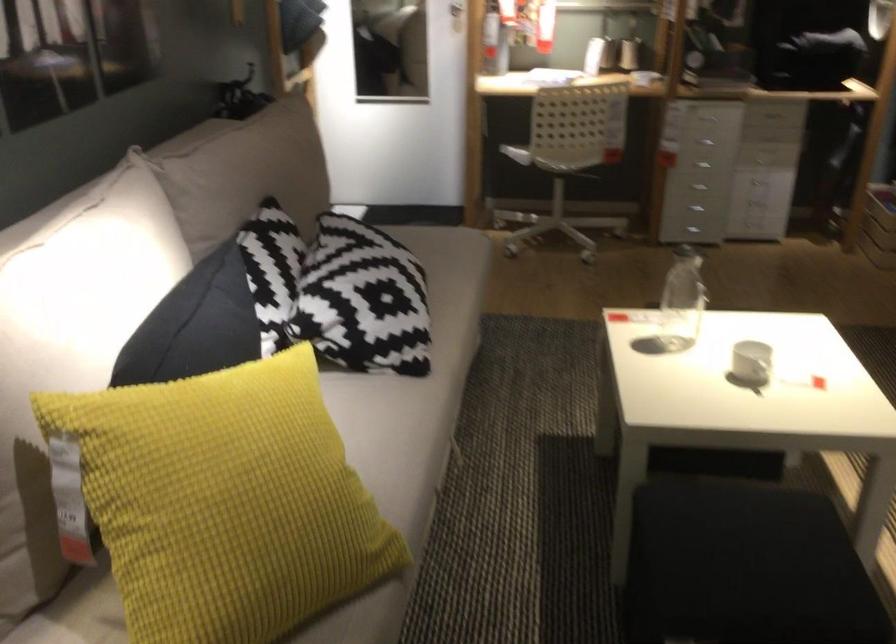
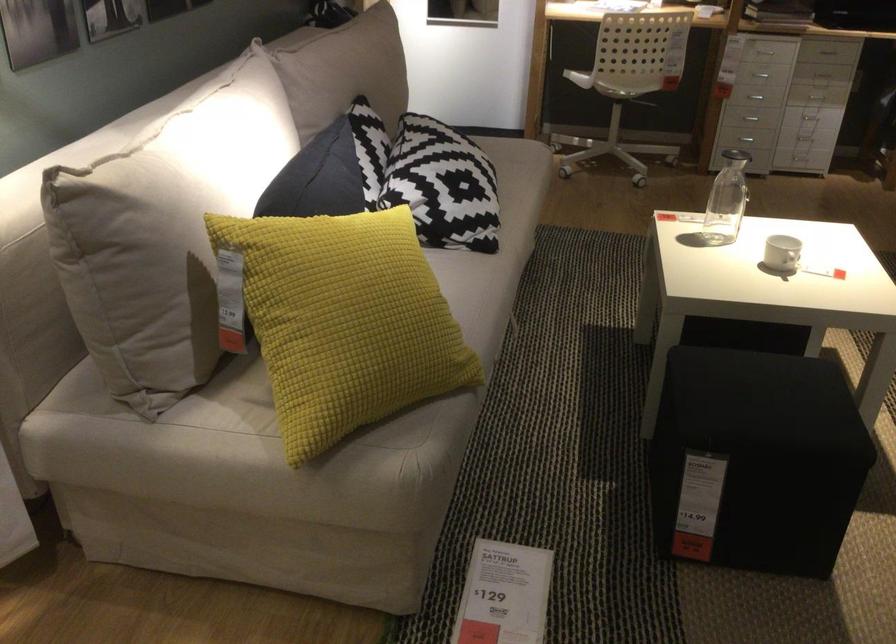
The point at (769, 167) is marked in the first image. Where is the corresponding point in the second image?

(815, 96)